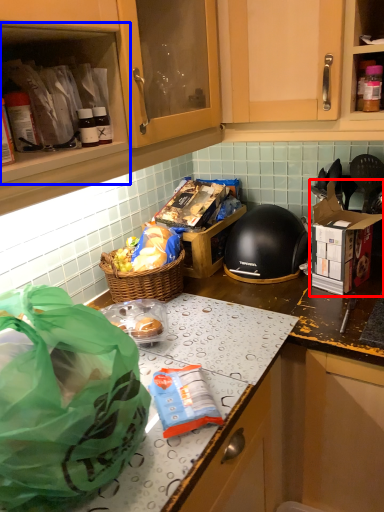
Question: Which of the following is the farthest to the observer, cardboard box (highlighted by a red box) or cabinetry (highlighted by a blue box)?

Choices:
 (A) cardboard box
 (B) cabinetry

Answer: (A)